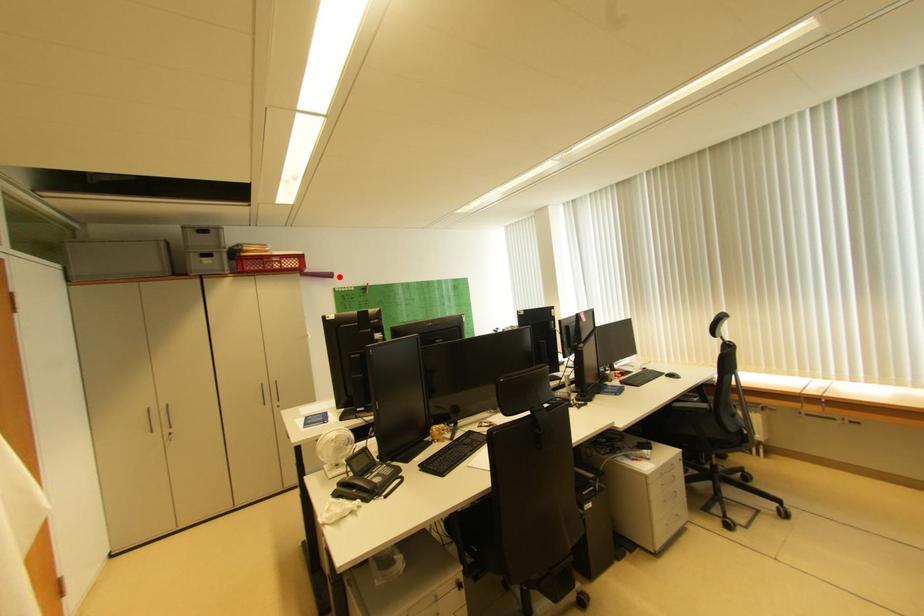
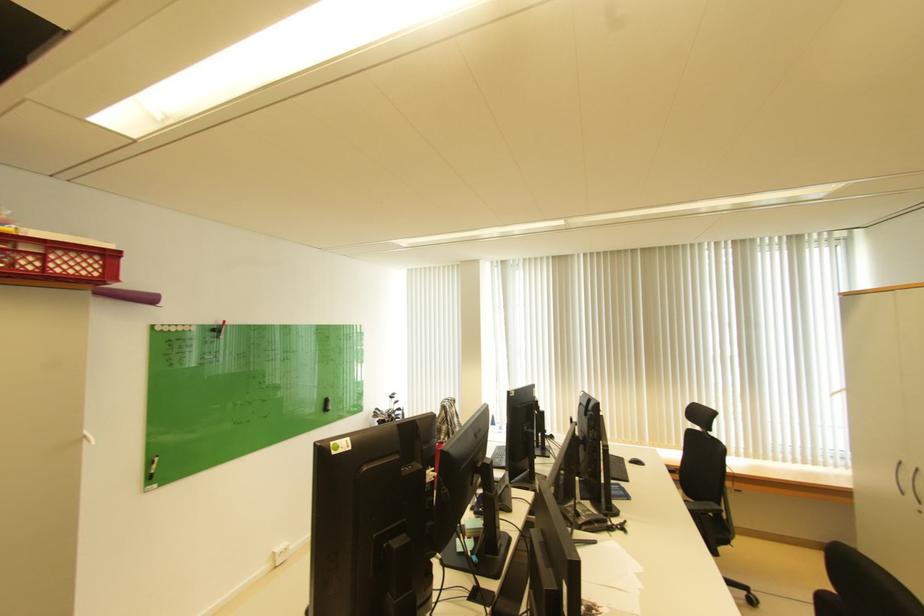
Find the pixel in the second image that matches the highlighted location in the first image.

(160, 301)